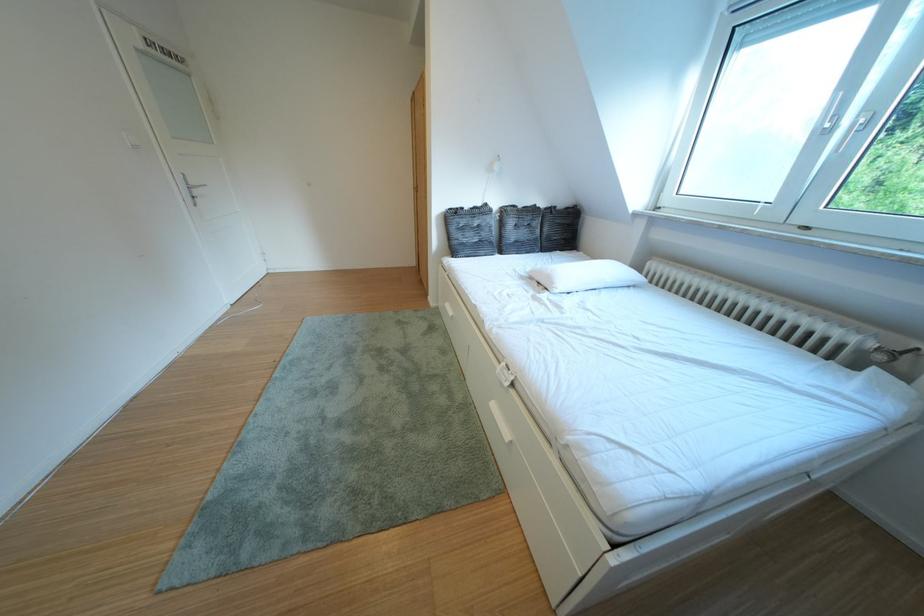
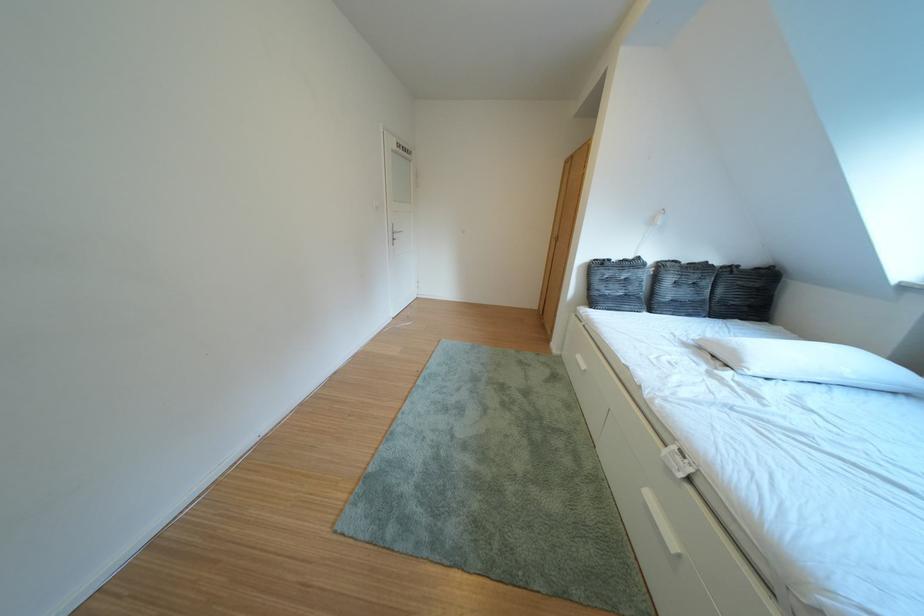
In a continuous first-person perspective shot, in which direction is the camera moving?

The movement direction of the cameraman is left, backward.